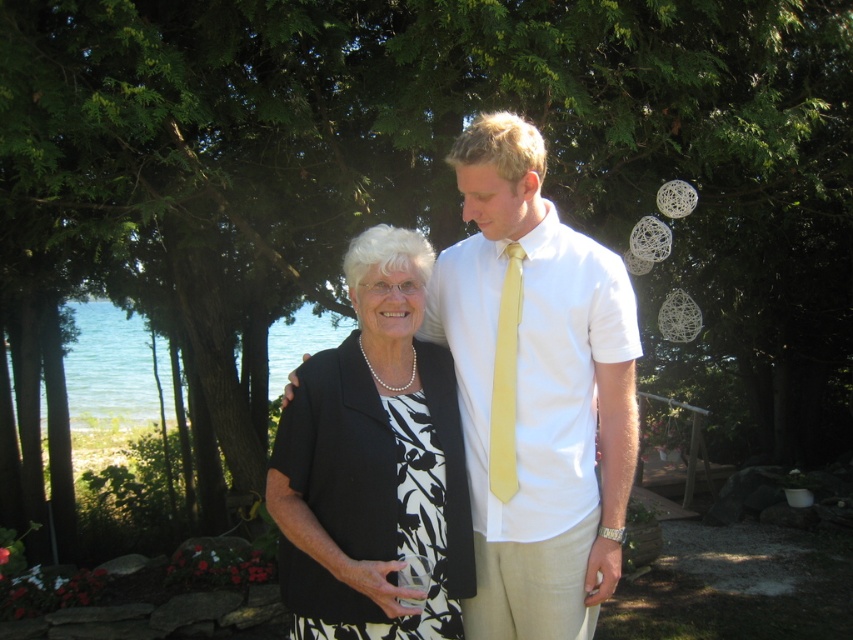
Question: Among these points, which one is nearest to the camera?

Choices:
 (A) (496, 404)
 (B) (310, 534)
 (C) (553, 257)

Answer: (B)

Question: Is white cotton shirt at center positioned before yellow satin tie at center?

Choices:
 (A) yes
 (B) no

Answer: (A)

Question: Can you confirm if white cotton shirt at center is positioned above black matte dress at center?

Choices:
 (A) no
 (B) yes

Answer: (B)

Question: Which of the following is the farthest from the observer?

Choices:
 (A) white cotton shirt at center
 (B) black matte dress at center
 (C) yellow satin tie at center

Answer: (C)

Question: Can you confirm if black matte dress at center is smaller than yellow satin tie at center?

Choices:
 (A) no
 (B) yes

Answer: (A)

Question: Among these points, which one is nearest to the camera?

Choices:
 (A) (500, 634)
 (B) (511, 488)
 (C) (403, 262)

Answer: (C)